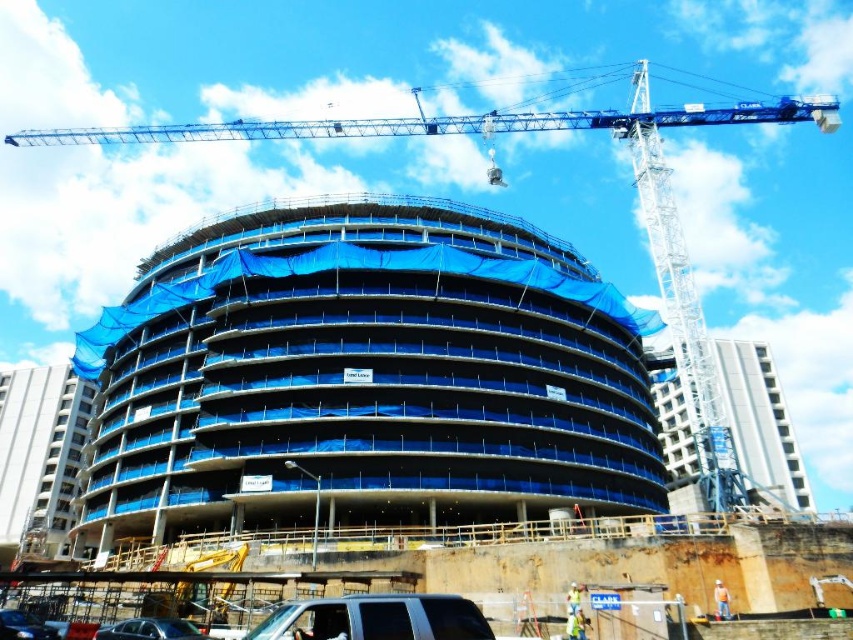
Does matte black suv at lower center lie behind white hard hat at lower right?

No, it is in front of white hard hat at lower right.

Is point (364, 602) positioned after point (721, 612)?

No, (364, 602) is in front of (721, 612).

Find the location of a particular element. The height and width of the screenshot is (640, 853). matte black suv at lower center is located at coordinates (375, 618).

Locate an element on the screen. blue metallic crane at upper center is located at coordinates (548, 129).

Which is above, blue metallic crane at upper center or matte black suv at lower center?

blue metallic crane at upper center is higher up.

Is point (701, 113) farther from viewer compared to point (440, 616)?

Yes, it is behind point (440, 616).

Where is `blue metallic crane at upper center`? The width and height of the screenshot is (853, 640). blue metallic crane at upper center is located at coordinates (548, 129).

Is brown concrete wall at lower center thinner than shiny black car at lower left?

No.

This screenshot has width=853, height=640. What do you see at coordinates (479, 572) in the screenshot?
I see `brown concrete wall at lower center` at bounding box center [479, 572].

Between point (637, 541) and point (47, 634), which one is positioned behind?

The point (637, 541) is more distant.

I want to click on brown concrete wall at lower center, so click(479, 572).